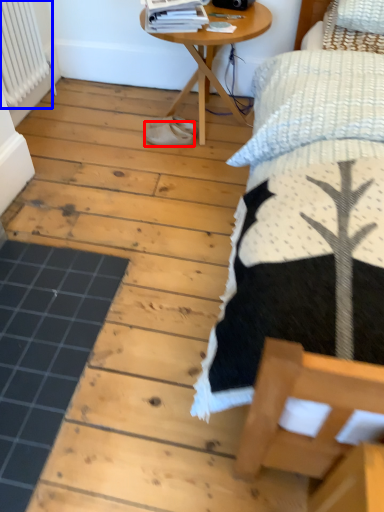
Question: Which point is further to the camera, footwear (highlighted by a red box) or radiator (highlighted by a blue box)?

Choices:
 (A) footwear
 (B) radiator

Answer: (A)